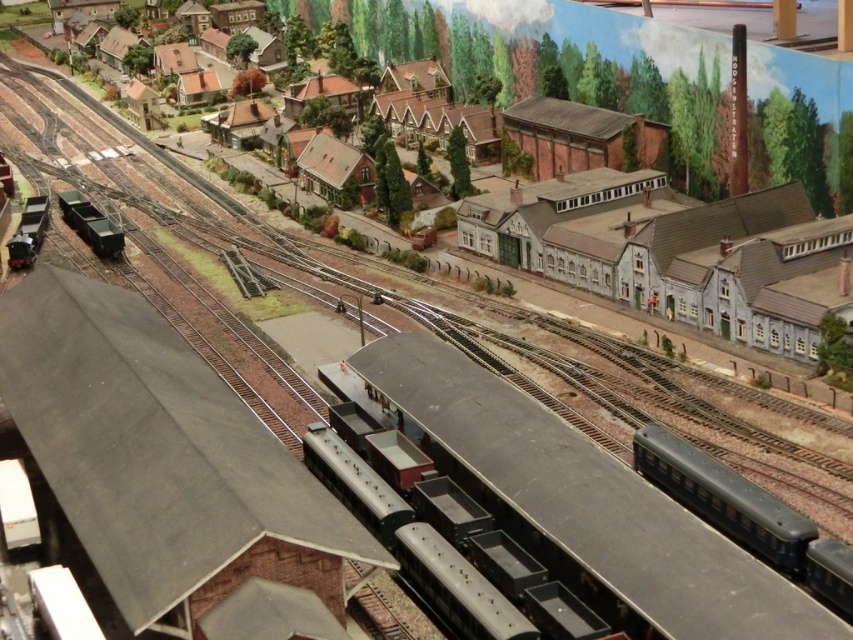
Question: Which of these objects is positioned closest to the smooth gray roof at center?

Choices:
 (A) matte black train at center
 (B) shiny black train at lower left
 (C) metallic green freight car at left
 (D) smooth gray station at center

Answer: (A)

Question: Can you confirm if matte black train at center is bigger than metallic green freight car at left?

Choices:
 (A) yes
 (B) no

Answer: (A)

Question: Observing the image, what is the correct spatial positioning of matte black train at center in reference to metallic green freight car at left?

Choices:
 (A) above
 (B) below

Answer: (B)

Question: Can you confirm if matte black train at center is positioned to the right of metallic green freight car at left?

Choices:
 (A) yes
 (B) no

Answer: (A)

Question: Which point is closer to the camera?

Choices:
 (A) matte black train at center
 (B) shiny black train at lower left
 (C) metallic green freight car at left
 (D) smooth gray roof at center

Answer: (A)

Question: Considering the real-world distances, which object is farthest from the matte black train at center?

Choices:
 (A) shiny black train at lower left
 (B) smooth gray station at center

Answer: (A)